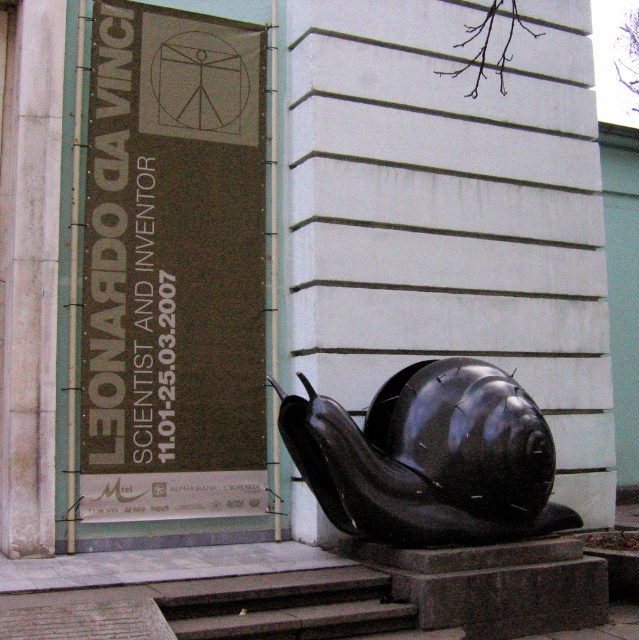
Question: Does black matte snail at center appear on the right side of gray stone stairs at lower center?

Choices:
 (A) no
 (B) yes

Answer: (B)

Question: Which object is farther from the camera taking this photo?

Choices:
 (A) black matte snail at center
 (B) gray stone stairs at lower center

Answer: (A)

Question: Is black matte snail at center smaller than gray stone stairs at lower center?

Choices:
 (A) no
 (B) yes

Answer: (A)

Question: Can you confirm if black matte snail at center is wider than gray stone stairs at lower center?

Choices:
 (A) no
 (B) yes

Answer: (B)